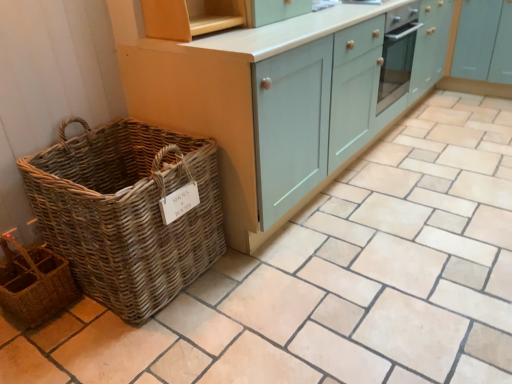
Identify the location of unoccupied area in front of woven brown basket at left. (133, 344).